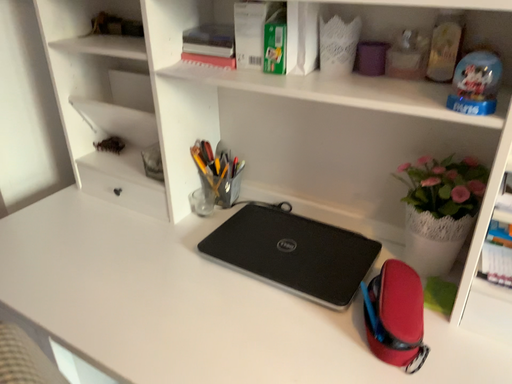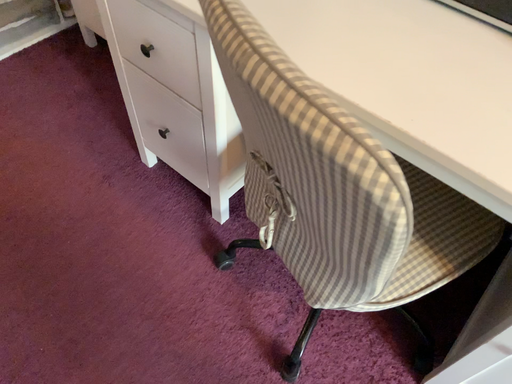
Question: Which way did the camera rotate in the video?

Choices:
 (A) rotated left
 (B) rotated right

Answer: (A)